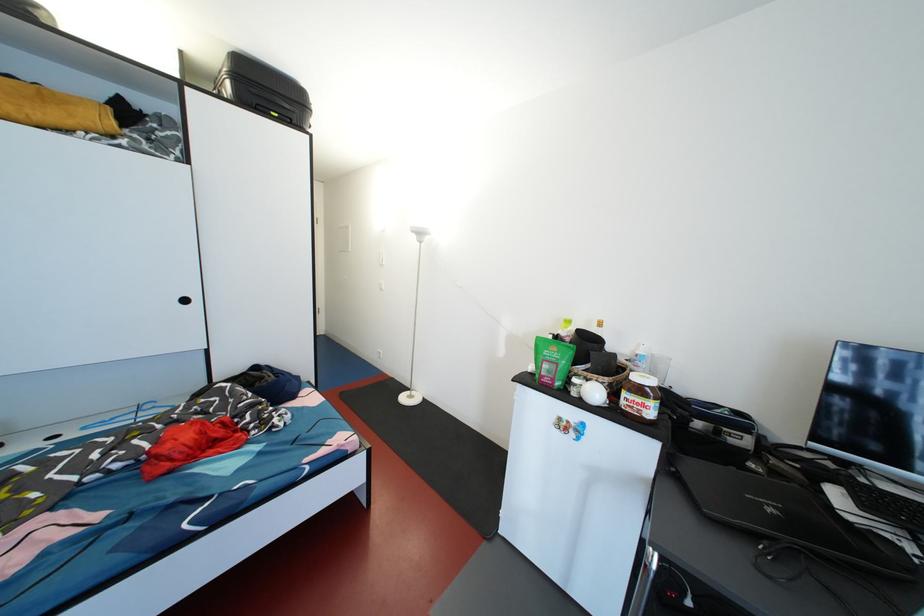
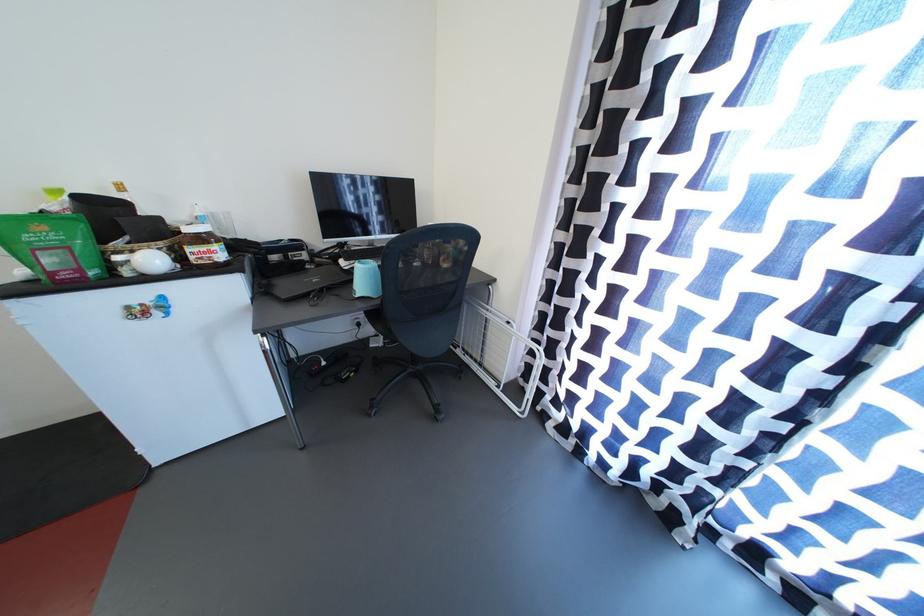
Where in the second image is the point corresponding to point 573,337 from the first image?

(64, 209)